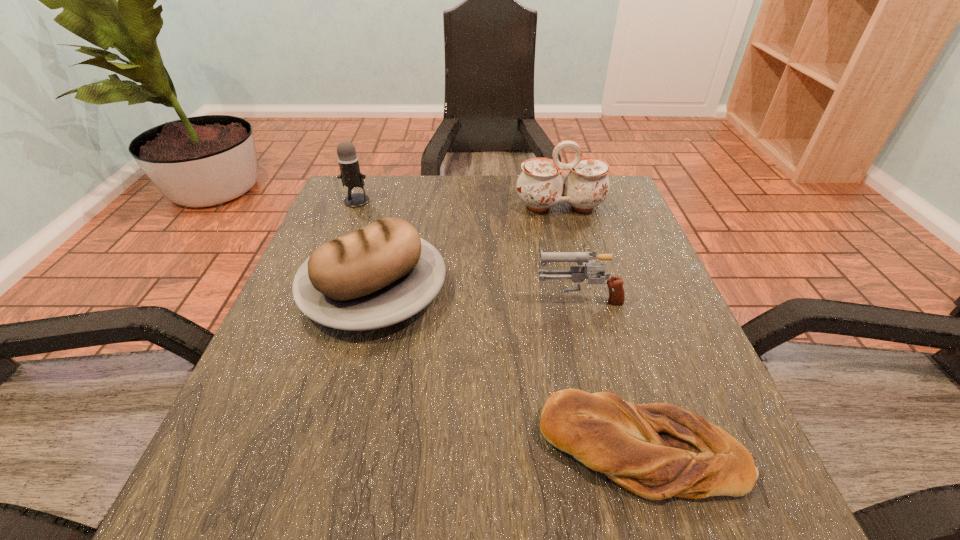
Where is `free location at the near left corner`? free location at the near left corner is located at coordinates (307, 491).

Where is `free space at the far right corner`? This screenshot has width=960, height=540. free space at the far right corner is located at coordinates click(568, 205).

Locate an element on the screen. vacant space that is in between the chinaware and the gun is located at coordinates [x=569, y=252].

You are a GUI agent. You are given a task and a screenshot of the screen. Output one action in this format:
    pyautogui.click(x=<x>, y=<y>)
    Task: Click on the free point between the chinaware and the gun
    The width and height of the screenshot is (960, 540).
    Given the screenshot: What is the action you would take?
    pyautogui.click(x=569, y=252)

I want to click on free area in between the taller bread and the right bread, so click(508, 368).

Where is `free spot between the chinaware and the left bread`? The height and width of the screenshot is (540, 960). free spot between the chinaware and the left bread is located at coordinates (467, 247).

Find the location of a particular element. The width and height of the screenshot is (960, 540). free space between the chinaware and the left bread is located at coordinates [x=467, y=247].

Where is `vacant space that is in between the taller bread and the nearer bread`? The width and height of the screenshot is (960, 540). vacant space that is in between the taller bread and the nearer bread is located at coordinates (508, 368).

This screenshot has width=960, height=540. What are the coordinates of `empty location between the left bread and the gun` in the screenshot? It's located at (476, 293).

This screenshot has width=960, height=540. Find the location of `free area in between the farther bread and the chinaware`. free area in between the farther bread and the chinaware is located at coordinates (467, 247).